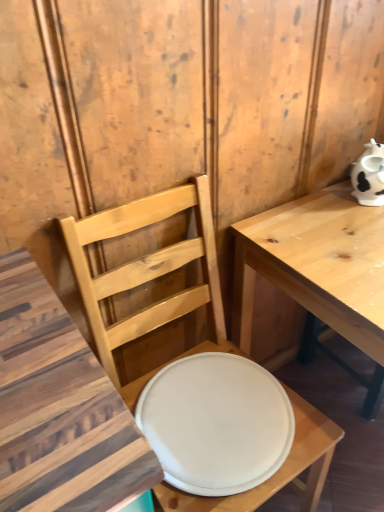
Question: Does matte wood chair at center have a lesser width compared to light wood table at right?

Choices:
 (A) no
 (B) yes

Answer: (B)

Question: Is matte wood chair at center at the right side of light wood table at right?

Choices:
 (A) no
 (B) yes

Answer: (A)

Question: Is matte wood chair at center far from light wood table at right?

Choices:
 (A) yes
 (B) no

Answer: (B)

Question: Considering the relative sizes of matte wood chair at center and light wood table at right in the image provided, is matte wood chair at center wider than light wood table at right?

Choices:
 (A) no
 (B) yes

Answer: (A)

Question: From a real-world perspective, is matte wood chair at center below light wood table at right?

Choices:
 (A) no
 (B) yes

Answer: (A)

Question: Considering the positions of white matte plate at center and matte wood chair at center in the image, is white matte plate at center bigger or smaller than matte wood chair at center?

Choices:
 (A) small
 (B) big

Answer: (A)

Question: Is white matte plate at center wider or thinner than matte wood chair at center?

Choices:
 (A) thin
 (B) wide

Answer: (A)

Question: From their relative heights in the image, would you say white matte plate at center is taller or shorter than matte wood chair at center?

Choices:
 (A) tall
 (B) short

Answer: (B)

Question: Is point (205, 487) closer or farther from the camera than point (246, 502)?

Choices:
 (A) closer
 (B) farther

Answer: (A)

Question: Considering the positions of light wood table at right and matte wood chair at center in the image, is light wood table at right bigger or smaller than matte wood chair at center?

Choices:
 (A) big
 (B) small

Answer: (A)

Question: In the image, is light wood table at right positioned in front of or behind matte wood chair at center?

Choices:
 (A) behind
 (B) front

Answer: (A)

Question: Is light wood table at right wider or thinner than matte wood chair at center?

Choices:
 (A) thin
 (B) wide

Answer: (B)

Question: Visually, is light wood table at right positioned to the left or to the right of matte wood chair at center?

Choices:
 (A) left
 (B) right

Answer: (B)

Question: From the image's perspective, is light wood table at right positioned above or below white matte plate at center?

Choices:
 (A) above
 (B) below

Answer: (A)

Question: Relative to white matte plate at center, is light wood table at right in front or behind?

Choices:
 (A) behind
 (B) front

Answer: (B)